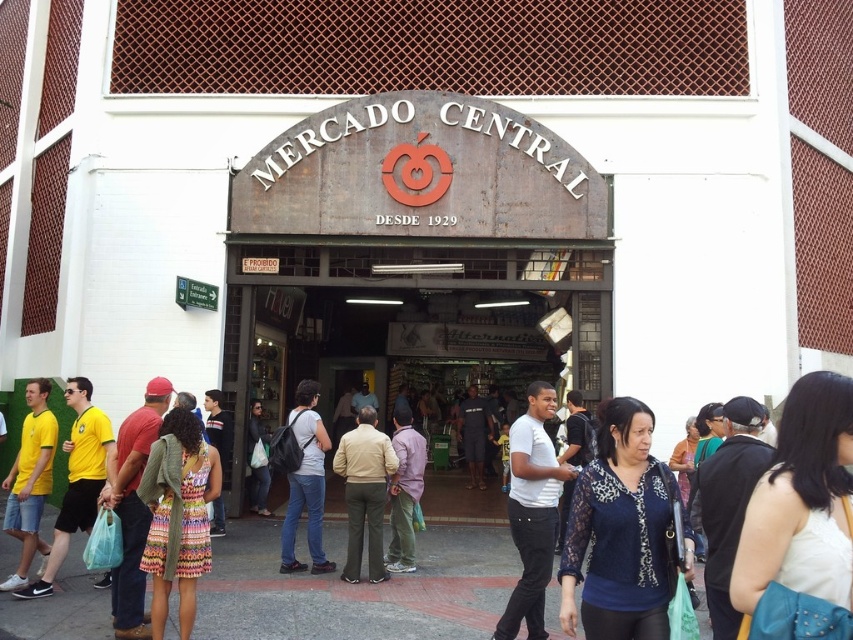
Question: Which point is closer to the camera?

Choices:
 (A) yellow fabric shirt at left
 (B) yellow matte shirt at lower left
 (C) matte black backpack at center
 (D) yellow t-shirt at left

Answer: (D)

Question: From the image, what is the correct spatial relationship of multicolored fabric dress at center in relation to denim jacket at center?

Choices:
 (A) above
 (B) below

Answer: (A)

Question: Which is nearer to the matte black backpack at center?

Choices:
 (A) khaki pants at center
 (B) yellow fabric shirt at left
 (C) blue lace shirt at center
 (D) yellow matte shirt at lower left

Answer: (A)

Question: Does rusty metal mercado central sign at center have a greater width compared to yellow matte shirt at lower left?

Choices:
 (A) no
 (B) yes

Answer: (B)

Question: Among these points, which one is farthest from the camera?

Choices:
 (A) (355, 433)
 (B) (312, 602)

Answer: (A)

Question: Can you confirm if rusty metal mercado central sign at center is smaller than blue lace shirt at center?

Choices:
 (A) no
 (B) yes

Answer: (A)